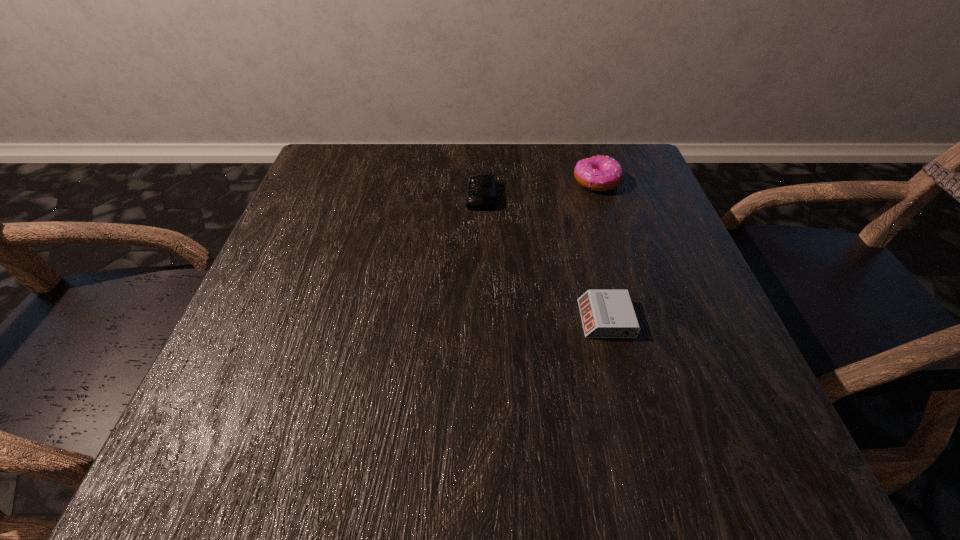
This screenshot has height=540, width=960. In order to click on free location that satisfies the following two spatial constraints: 1. on the back side of the nearer alarm clock; 2. on the display of the left alarm clock in this screenshot , I will do `click(575, 196)`.